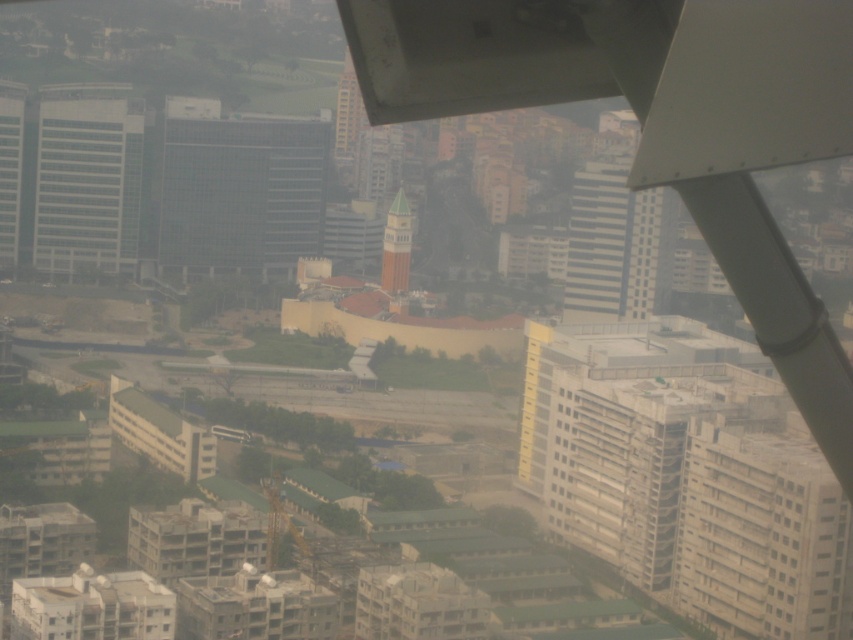
Between transparent glass building at center and green painted tower at center, which one appears on the right side from the viewer's perspective?

Positioned to the right is green painted tower at center.

Which is more to the left, transparent glass building at center or green painted tower at center?

Positioned to the left is transparent glass building at center.

Describe the element at coordinates (239, 189) in the screenshot. This screenshot has height=640, width=853. I see `transparent glass building at center` at that location.

Where is `transparent glass building at center`? This screenshot has width=853, height=640. transparent glass building at center is located at coordinates (239, 189).

Based on the photo, can you confirm if transparent glass building at center is positioned below glassy reflective skyscraper at left?

Correct, transparent glass building at center is located below glassy reflective skyscraper at left.

Who is more distant from viewer, (258, 243) or (10, 109)?

Positioned behind is point (10, 109).

Does point (231, 173) come behind point (1, 90)?

That is False.

This screenshot has height=640, width=853. Identify the location of transparent glass building at center. (239, 189).

Is yellow matte building at center taller than green painted tower at center?

Correct, yellow matte building at center is much taller as green painted tower at center.

Between yellow matte building at center and green painted tower at center, which one has less height?

green painted tower at center is shorter.

Who is more distant from viewer, (727, 384) or (392, 221)?

The point (727, 384) is behind.

The image size is (853, 640). Find the location of `yellow matte building at center`. yellow matte building at center is located at coordinates (680, 472).